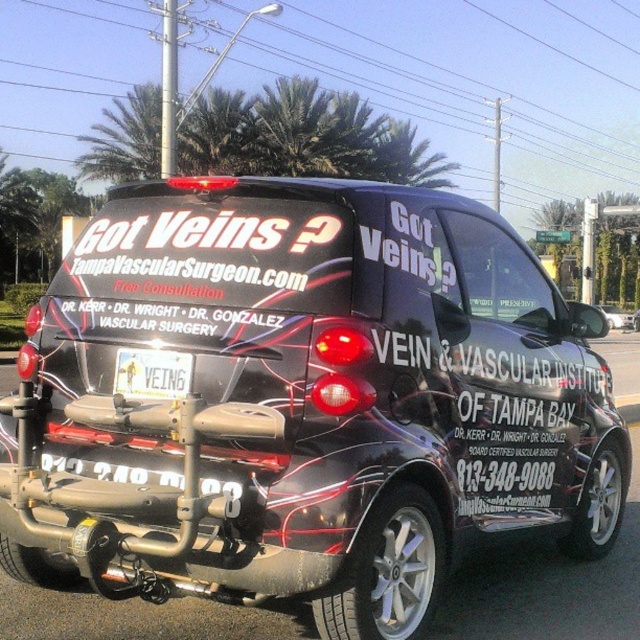
Question: Which object is the closest to the black matte vehicle at center?

Choices:
 (A) glossy black car at center
 (B) white plastic license plate at rear
 (C) black matte car at center

Answer: (B)

Question: Among these points, which one is farthest from the camera?

Choices:
 (A) (113, 529)
 (B) (614, 310)
 (C) (163, 365)

Answer: (B)

Question: From the image, what is the correct spatial relationship of white plastic license plate at rear in relation to black matte car at center?

Choices:
 (A) right
 (B) left

Answer: (B)

Question: Which of the following is the farthest from the observer?

Choices:
 (A) glossy black car at center
 (B) black matte car at center

Answer: (B)

Question: Can you confirm if white plastic license plate at rear is bigger than black matte car at center?

Choices:
 (A) no
 (B) yes

Answer: (A)

Question: Can you confirm if black matte vehicle at center is positioned to the left of white plastic license plate at rear?

Choices:
 (A) yes
 (B) no

Answer: (A)